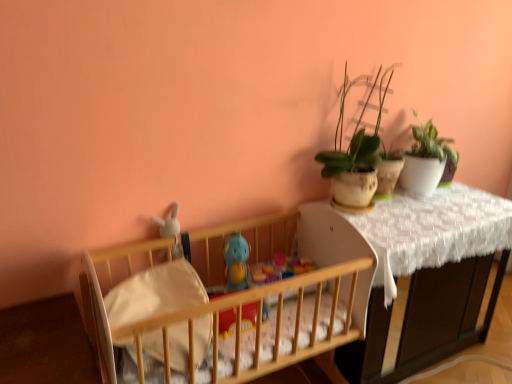
The width and height of the screenshot is (512, 384). What are the coordinates of `free point above white fabric changing table at lower left (from a real-world perspective)` in the screenshot? It's located at (44, 338).